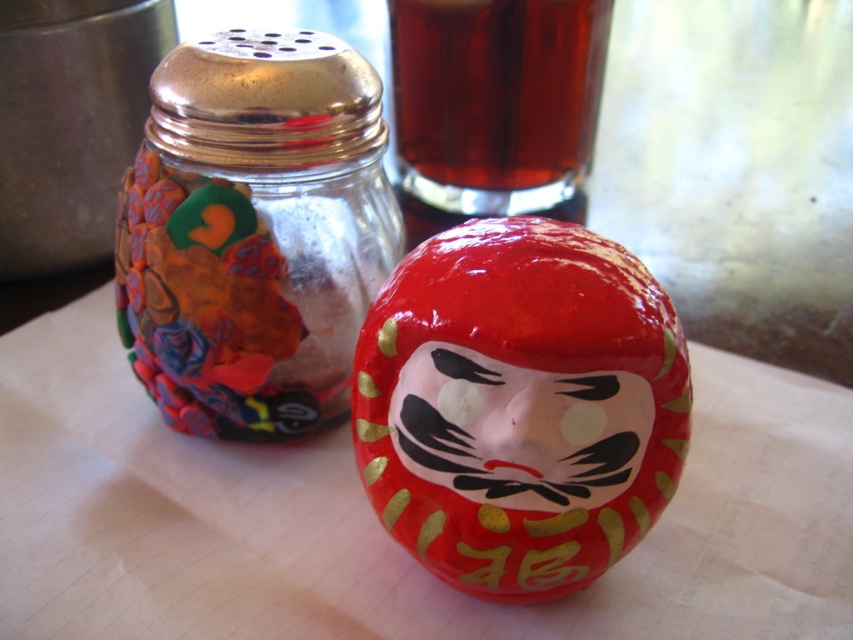
Question: Among these points, which one is nearest to the camera?

Choices:
 (A) (328, 362)
 (B) (407, 35)

Answer: (A)

Question: Among these objects, which one is nearest to the camera?

Choices:
 (A) multicolored glass jar at left
 (B) brown liquid at upper center

Answer: (A)

Question: Which point is farther from the camera taking this photo?

Choices:
 (A) (199, 435)
 (B) (554, 1)

Answer: (B)

Question: Does multicolored glass jar at left have a greater width compared to brown liquid at upper center?

Choices:
 (A) yes
 (B) no

Answer: (B)

Question: Can you confirm if brown liquid at upper center is thinner than glossy ceramic face at center?

Choices:
 (A) no
 (B) yes

Answer: (A)

Question: Observing the image, what is the correct spatial positioning of brown liquid at upper center in reference to glossy ceramic face at center?

Choices:
 (A) above
 (B) below

Answer: (A)